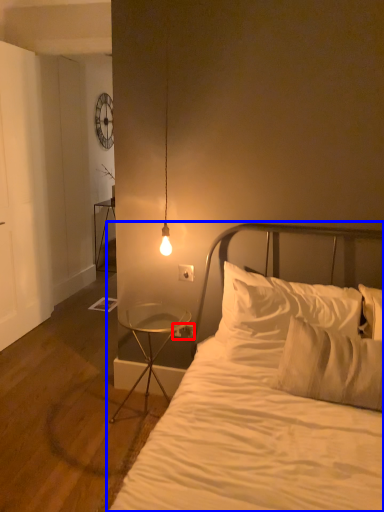
Question: Which point is closer to the camera, electric outlet (highlighted by a red box) or bed (highlighted by a blue box)?

Choices:
 (A) electric outlet
 (B) bed

Answer: (B)